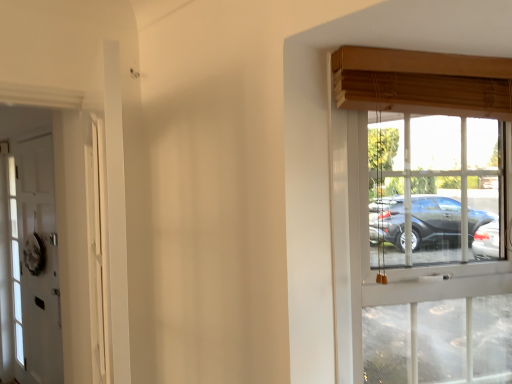
The width and height of the screenshot is (512, 384). I want to click on clear glass window at right, so click(425, 215).

Describe the element at coordinates (425, 215) in the screenshot. I see `clear glass window at right` at that location.

This screenshot has height=384, width=512. I want to click on clear glass window at right, so click(425, 215).